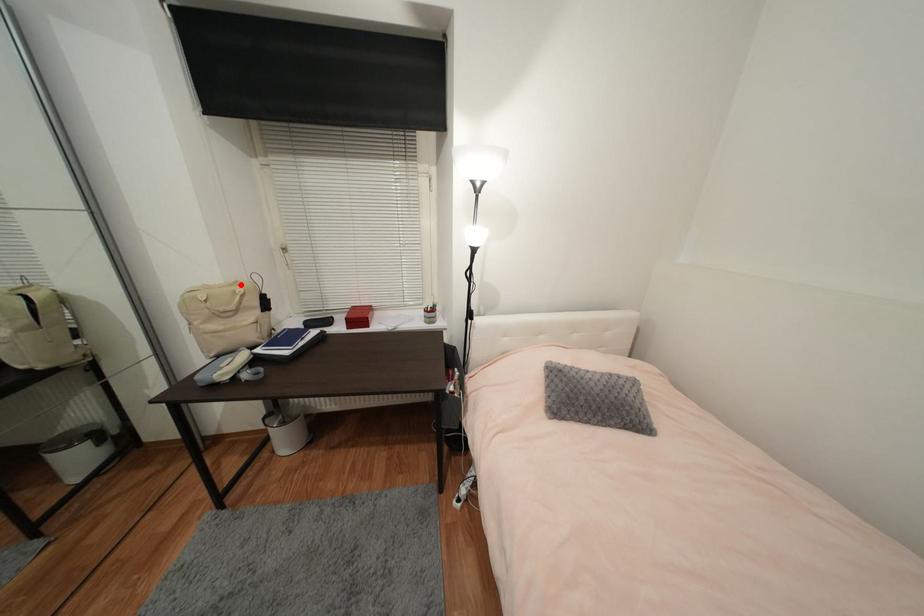
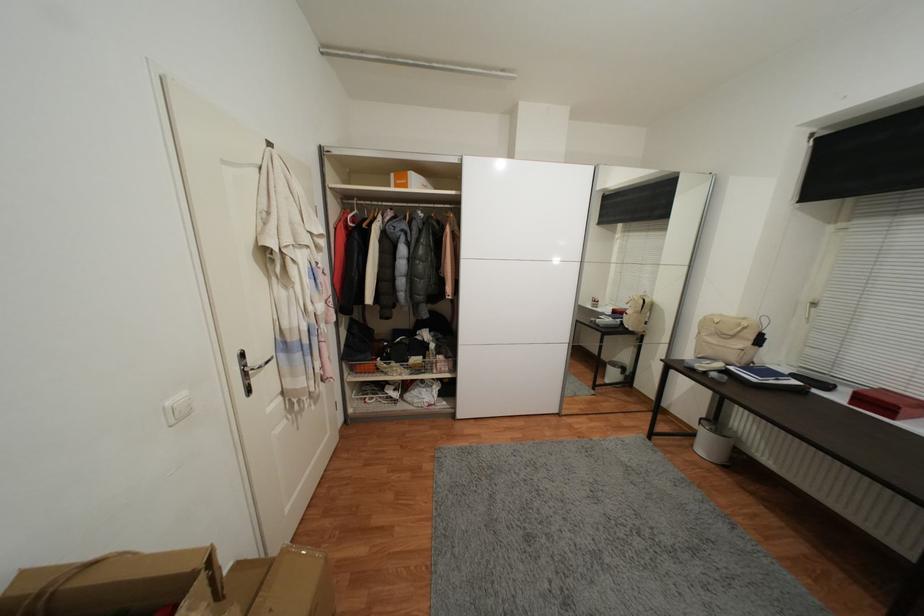
In the second image, find the point that corresponds to the highlighted location in the first image.

(748, 321)